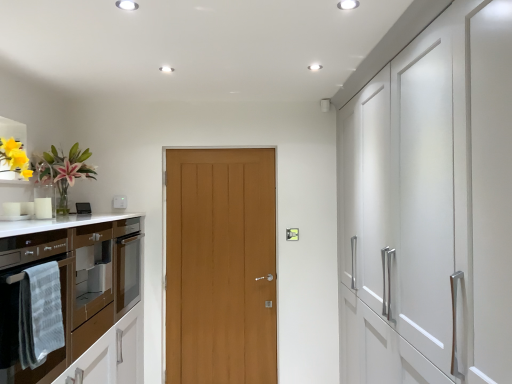
Question: Is wooden door at center, the 1th door when ordered from front to back, with white plastic switch at upper center?

Choices:
 (A) yes
 (B) no

Answer: (B)

Question: Considering the relative sizes of wooden door at center, the 1th door when ordered from front to back, and white plastic switch at upper center in the image provided, is wooden door at center, the 1th door when ordered from front to back, shorter than white plastic switch at upper center?

Choices:
 (A) no
 (B) yes

Answer: (A)

Question: Considering the relative sizes of wooden door at center, the 2th door in the back-to-front sequence, and white plastic switch at upper center in the image provided, is wooden door at center, the 2th door in the back-to-front sequence, bigger than white plastic switch at upper center?

Choices:
 (A) no
 (B) yes

Answer: (B)

Question: Can you confirm if wooden door at center, the 2th door in the back-to-front sequence, is smaller than white plastic switch at upper center?

Choices:
 (A) no
 (B) yes

Answer: (A)

Question: Does wooden door at center, the 1th door when ordered from front to back, have a lesser width compared to white plastic switch at upper center?

Choices:
 (A) no
 (B) yes

Answer: (A)

Question: Can you confirm if wooden door at center, the 2th door in the back-to-front sequence, is positioned to the left of white plastic switch at upper center?

Choices:
 (A) no
 (B) yes

Answer: (A)

Question: Would you say wooden door at center, the 1th door when ordered from front to back, contains light brown wood door at center, which is counted as the first door, starting from the back?

Choices:
 (A) no
 (B) yes

Answer: (B)

Question: Is the depth of wooden door at center, the 2th door in the back-to-front sequence, less than that of light brown wood door at center, acting as the second door starting from the front?

Choices:
 (A) no
 (B) yes

Answer: (B)

Question: From a real-world perspective, is wooden door at center, the 1th door when ordered from front to back, beneath light brown wood door at center, acting as the second door starting from the front?

Choices:
 (A) yes
 (B) no

Answer: (A)

Question: Does wooden door at center, the 1th door when ordered from front to back, come behind light brown wood door at center, which is counted as the first door, starting from the back?

Choices:
 (A) yes
 (B) no

Answer: (B)

Question: Could you tell me if wooden door at center, the 2th door in the back-to-front sequence, is facing light brown wood door at center, which is counted as the first door, starting from the back?

Choices:
 (A) yes
 (B) no

Answer: (A)

Question: Are wooden door at center, the 1th door when ordered from front to back, and light brown wood door at center, acting as the second door starting from the front, located far from each other?

Choices:
 (A) yes
 (B) no

Answer: (B)

Question: Does gray textured towel at left appear on the left side of brown glossy oven at left?

Choices:
 (A) no
 (B) yes

Answer: (A)